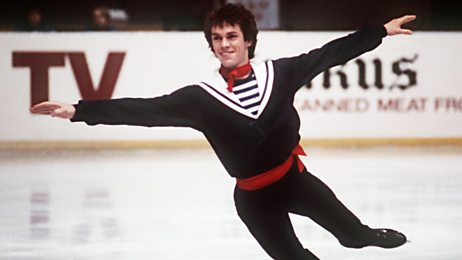
Locate an element on the screen. white board is located at coordinates (142, 73).